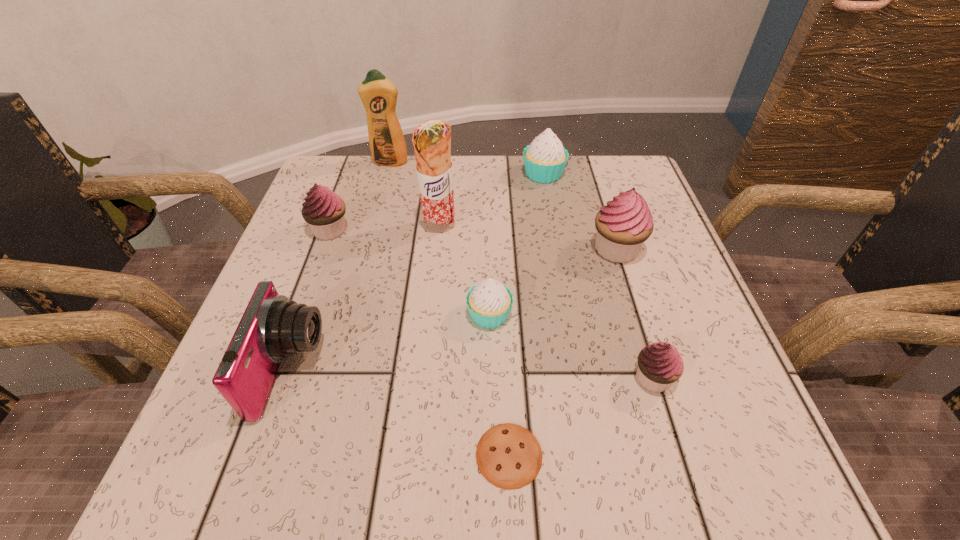
What are the coordinates of `object that is at the far left corner` in the screenshot? It's located at (378, 94).

You are a GUI agent. You are given a task and a screenshot of the screen. Output one action in this format:
    pyautogui.click(x=<x>, y=<y>)
    Task: Click on the object that is at the near left corner
    This screenshot has width=960, height=540.
    Given the screenshot: What is the action you would take?
    pyautogui.click(x=272, y=327)

Locate an element on the screen. free location at the far edge is located at coordinates (496, 164).

Identify the location of vacant space at the near edge of the desktop. This screenshot has height=540, width=960. (602, 450).

Locate an element on the screen. This screenshot has width=960, height=540. free space at the left edge of the desktop is located at coordinates (324, 353).

What are the coordinates of `free spot at the right edge of the desktop` in the screenshot? It's located at (661, 258).

You are a GUI agent. You are given a task and a screenshot of the screen. Output one action in this format:
    pyautogui.click(x=<x>, y=<y>)
    Task: Click on the vacant space at the far left corner
    This screenshot has width=960, height=540.
    Given the screenshot: What is the action you would take?
    pyautogui.click(x=323, y=172)

In the image, there is a desktop. At what (x,y) coordinates should I click in order to perform the action: click on vacant space at the far right corner. Please return your answer as a coordinate pair (x, y). This screenshot has height=540, width=960. Looking at the image, I should click on (660, 211).

Locate an element on the screen. Image resolution: width=960 pixels, height=540 pixels. free space between the tallest cupcake and the shortest object is located at coordinates (563, 352).

Find the location of `free point between the second biggest pink cupcake and the burrito`. free point between the second biggest pink cupcake and the burrito is located at coordinates (385, 228).